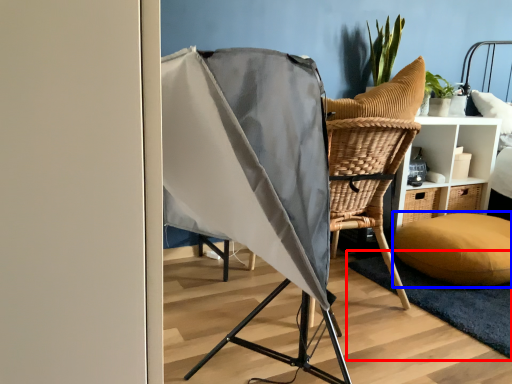
Question: Which of the following is the closest to the observer, mat (highlighted by a red box) or pillow (highlighted by a blue box)?

Choices:
 (A) mat
 (B) pillow

Answer: (A)